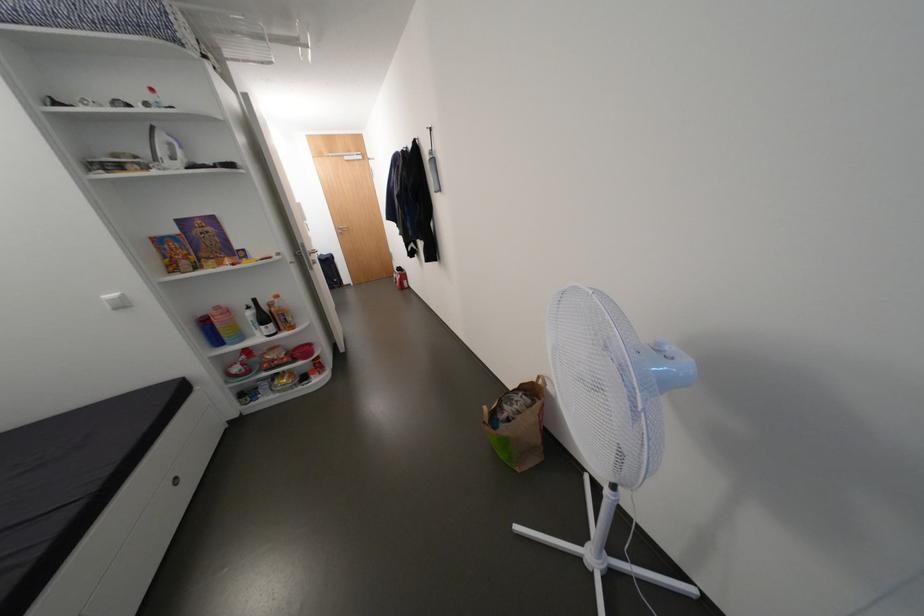
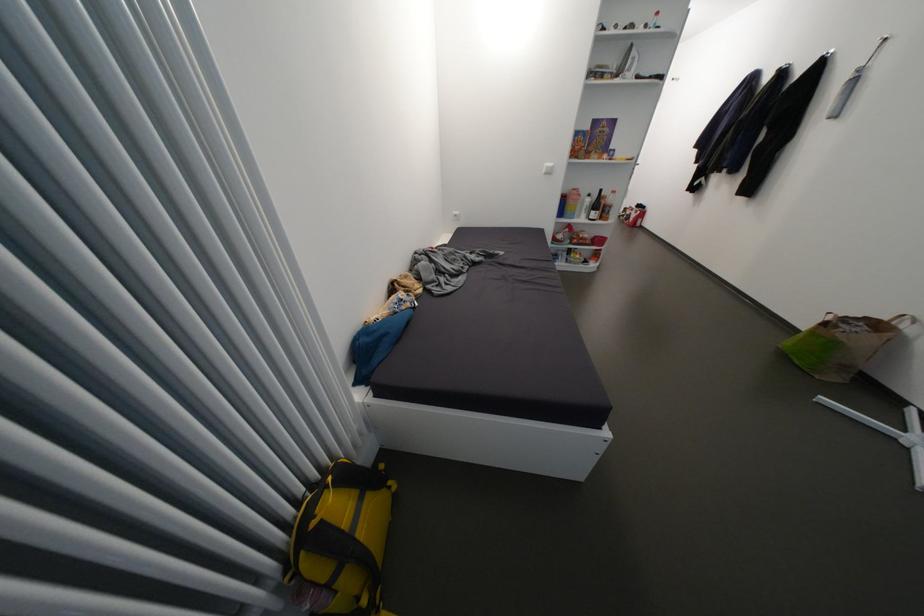
Locate, in the second image, the point that corresponds to [529,386] in the first image.

(872, 318)